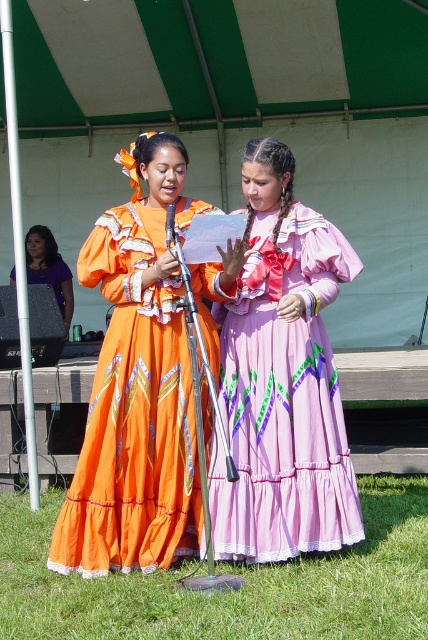
Question: Based on their relative distances, which object is nearer to the purple satin laptop at left?

Choices:
 (A) green grass at lower center
 (B) pink satin dress at center
 (C) matte orange dress at center

Answer: (C)

Question: Does pink satin dress at center appear over green grass at lower center?

Choices:
 (A) yes
 (B) no

Answer: (A)

Question: Can you confirm if pink satin dress at center is bigger than green grass at lower center?

Choices:
 (A) yes
 (B) no

Answer: (B)

Question: Which of the following is the farthest from the observer?

Choices:
 (A) (293, 481)
 (B) (184, 609)
 (C) (56, 264)

Answer: (C)

Question: Which of these objects is positioned closest to the purple satin laptop at left?

Choices:
 (A) matte orange dress at center
 (B) green grass at lower center

Answer: (A)

Question: From the image, what is the correct spatial relationship of matte orange dress at center in relation to purple satin laptop at left?

Choices:
 (A) left
 (B) right

Answer: (B)